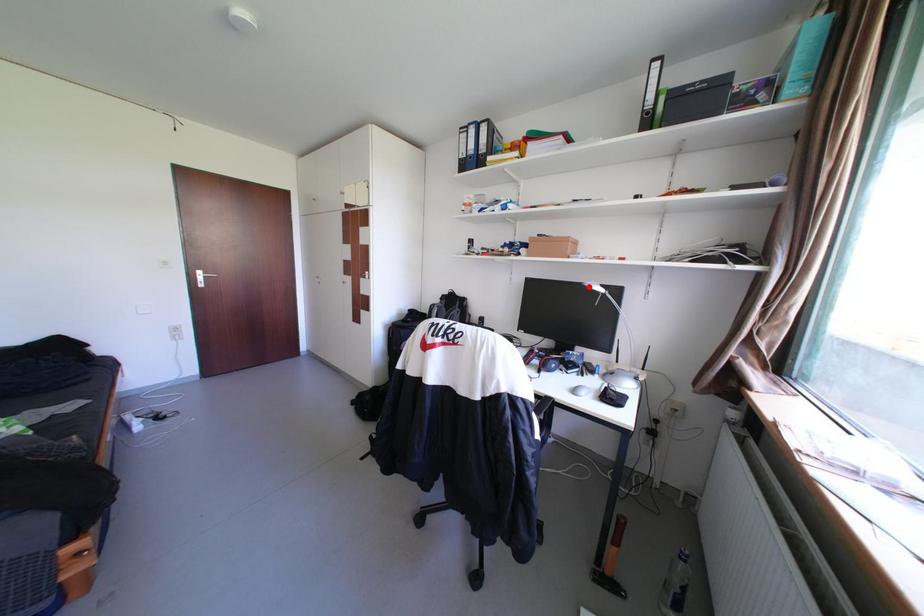
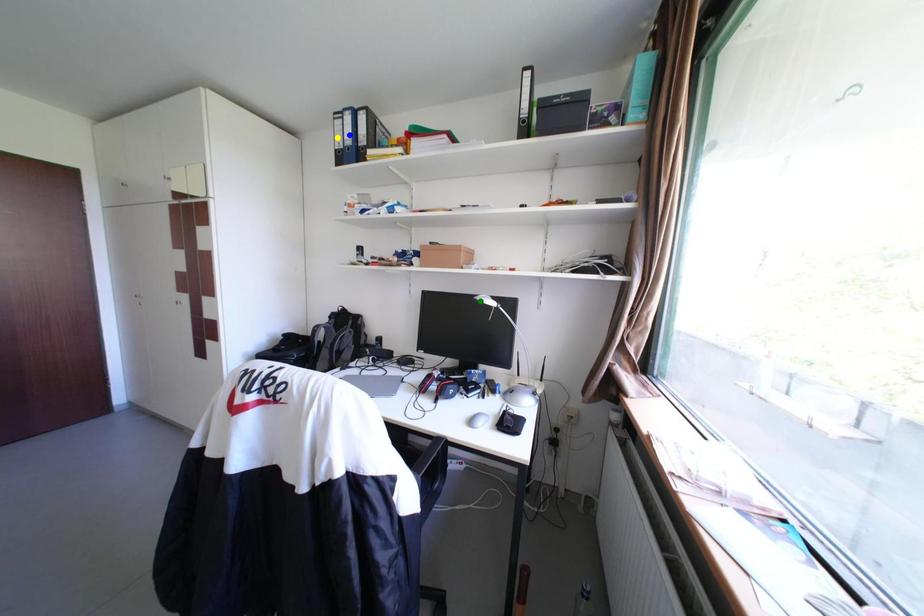
Question: I am providing you with two images of the same scene from different viewpoints. A red point is marked on the first image. You are given multiple points on the second image. Can you choose the point in image 2 that corresponds to the point in image 1?

Choices:
 (A) green point
 (B) yellow point
 (C) blue point

Answer: (A)